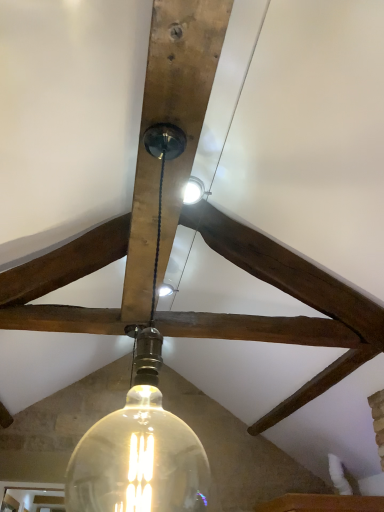
Question: Considering the relative positions of clear glass bulb at center and translucent glass light bulb at center in the image provided, is clear glass bulb at center to the left or to the right of translucent glass light bulb at center?

Choices:
 (A) left
 (B) right

Answer: (B)

Question: Is point (185, 481) positioned closer to the camera than point (76, 501)?

Choices:
 (A) closer
 (B) farther

Answer: (A)

Question: Considering the positions of clear glass bulb at center and translucent glass light bulb at center in the image, is clear glass bulb at center bigger or smaller than translucent glass light bulb at center?

Choices:
 (A) small
 (B) big

Answer: (A)

Question: Is point (94, 466) closer or farther from the camera than point (104, 466)?

Choices:
 (A) farther
 (B) closer

Answer: (A)

Question: Considering the positions of translucent glass light bulb at center and clear glass bulb at center in the image, is translucent glass light bulb at center bigger or smaller than clear glass bulb at center?

Choices:
 (A) small
 (B) big

Answer: (B)

Question: Looking at their shapes, would you say translucent glass light bulb at center is wider or thinner than clear glass bulb at center?

Choices:
 (A) wide
 (B) thin

Answer: (B)

Question: Is translucent glass light bulb at center to the left or to the right of clear glass bulb at center in the image?

Choices:
 (A) right
 (B) left

Answer: (B)